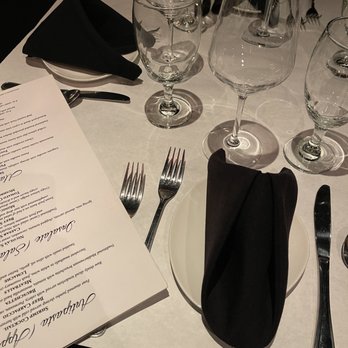
Where is `spoon`? spoon is located at coordinates (70, 97).